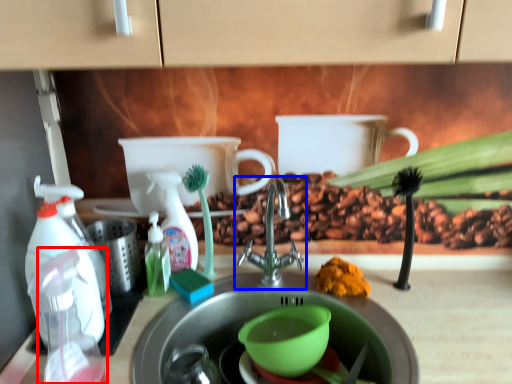
Question: Which object appears closest to the camera in this image, bottle (highlighted by a red box) or tap (highlighted by a blue box)?

Choices:
 (A) bottle
 (B) tap

Answer: (A)